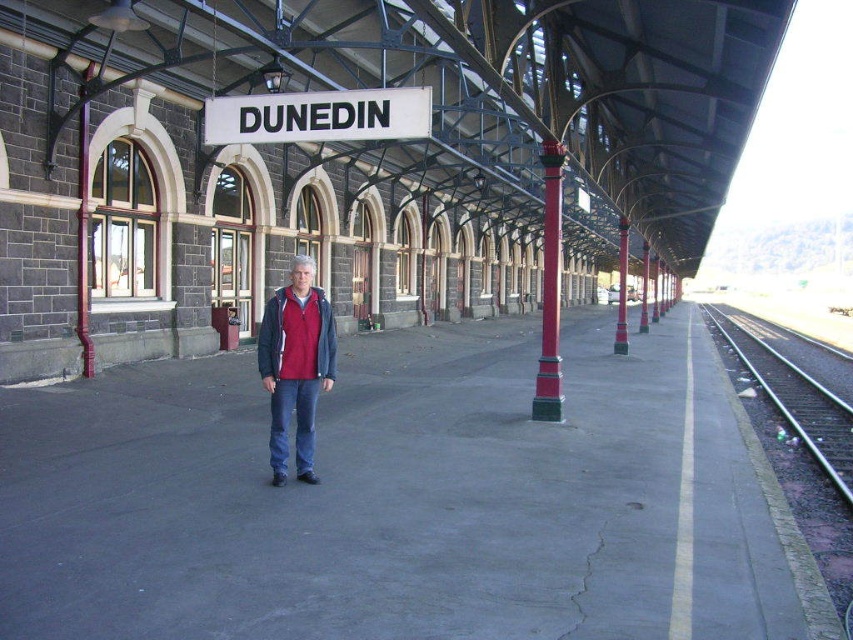
Question: Is red painted metal pole at center-right to the right of red painted metal pole at center from the viewer's perspective?

Choices:
 (A) no
 (B) yes

Answer: (A)

Question: Which object is closer to the camera taking this photo?

Choices:
 (A) red painted metal pole at left
 (B) matte red jacket at center
 (C) black asphalt train track at right
 (D) white plastic sign at upper center

Answer: (B)

Question: Which point is closer to the camera taking this photo?

Choices:
 (A) (544, 141)
 (B) (770, 387)
 (C) (80, 248)
 (D) (618, 228)

Answer: (A)

Question: Among these objects, which one is nearest to the camera?

Choices:
 (A) matte red jacket at center
 (B) red fleece jacket at center

Answer: (A)

Question: Does matte red jacket at center appear over red painted metal pole at left?

Choices:
 (A) no
 (B) yes

Answer: (A)

Question: Can you confirm if matte red jacket at center is positioned to the right of green painted metal pole at center?

Choices:
 (A) yes
 (B) no

Answer: (B)